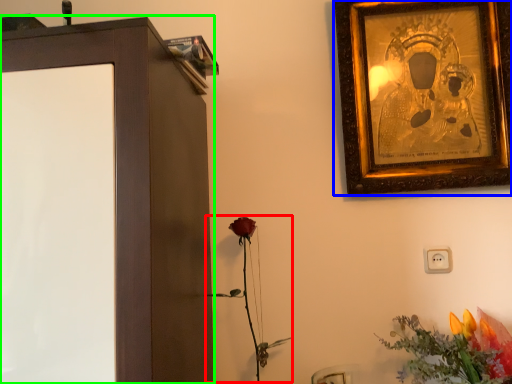
Question: Which object is positioned farthest from plant (highlighted by a red box)? Select from picture frame (highlighted by a blue box) and furniture (highlighted by a green box).

Choices:
 (A) picture frame
 (B) furniture

Answer: (A)